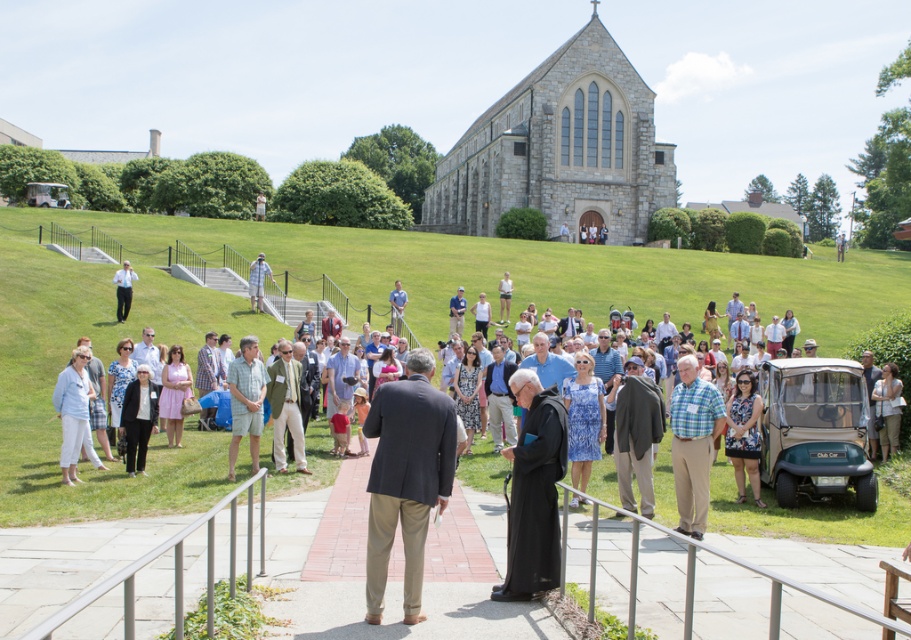
Does point (418, 384) lie in front of point (510, 285)?

Yes, it is.

Does dark gray suit at center have a greater height compared to white cotton dress at center?

Yes, dark gray suit at center is taller than white cotton dress at center.

Between point (416, 506) and point (504, 278), which one is positioned behind?

Point (504, 278)

The width and height of the screenshot is (911, 640). Find the location of `dark gray suit at center`. dark gray suit at center is located at coordinates (406, 477).

What do you see at coordinates (814, 429) in the screenshot? This screenshot has width=911, height=640. I see `green matte golf cart at center` at bounding box center [814, 429].

Which is in front, point (797, 474) or point (500, 317)?

Point (797, 474)

What do you see at coordinates (814, 429) in the screenshot? I see `green matte golf cart at center` at bounding box center [814, 429].

Find the location of a particular element. This screenshot has height=640, width=911. green matte golf cart at center is located at coordinates (814, 429).

Describe the element at coordinates (406, 477) in the screenshot. I see `dark gray suit at center` at that location.

Which is below, dark gray suit at center or green fabric suit at center?

Positioned lower is dark gray suit at center.

What do you see at coordinates (406, 477) in the screenshot? I see `dark gray suit at center` at bounding box center [406, 477].

Find the location of `dark gray suit at center`. dark gray suit at center is located at coordinates (406, 477).